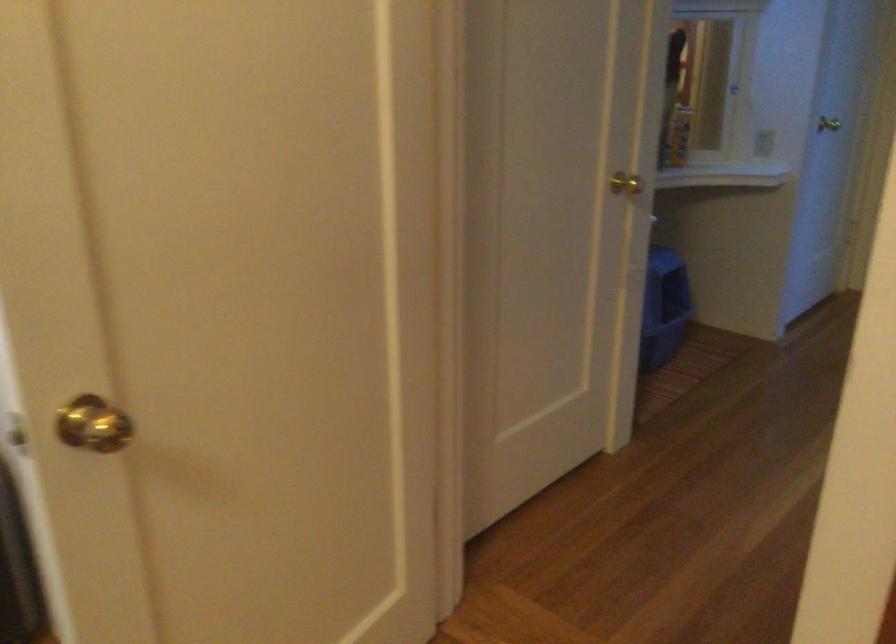
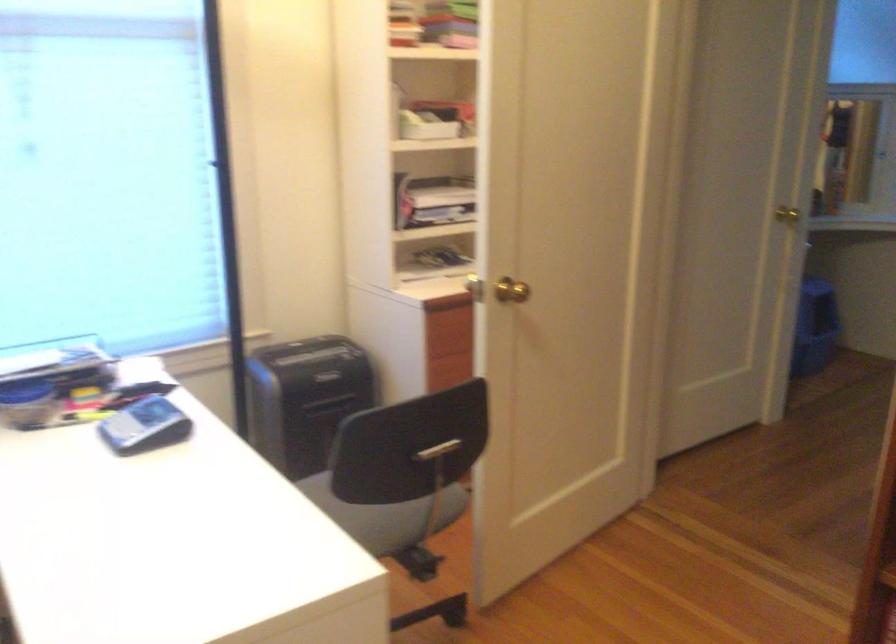
Find the pixel in the second image that matches the point at 664,308 in the first image.

(821, 333)